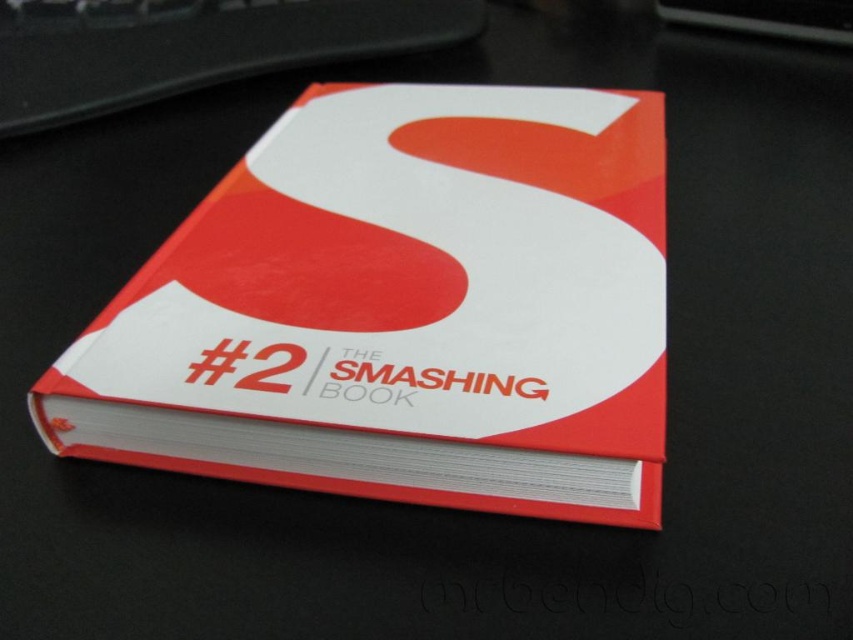
You are looking at the cover of the book and notice two points marked on it. Which point is closer to you, point (189, 292) or point (173, 65)?

Point (189, 292) is closer to the viewer than point (173, 65).

You are an art student analyzing the composition of the matte hardcover book at center in the image. Based on its position coordinates, can you determine if it is exactly at the center of the image?

The position of matte hardcover book at center is at point (403,308), which is very close to the center coordinates of (426,320). Therefore, it is positioned nearly at the center of the image.

You are organizing a desk and see the matte hardcover book at center and the black plastic keyboard at upper center. Which object is positioned lower on the desk?

The matte hardcover book at center is positioned lower than the black plastic keyboard at upper center.